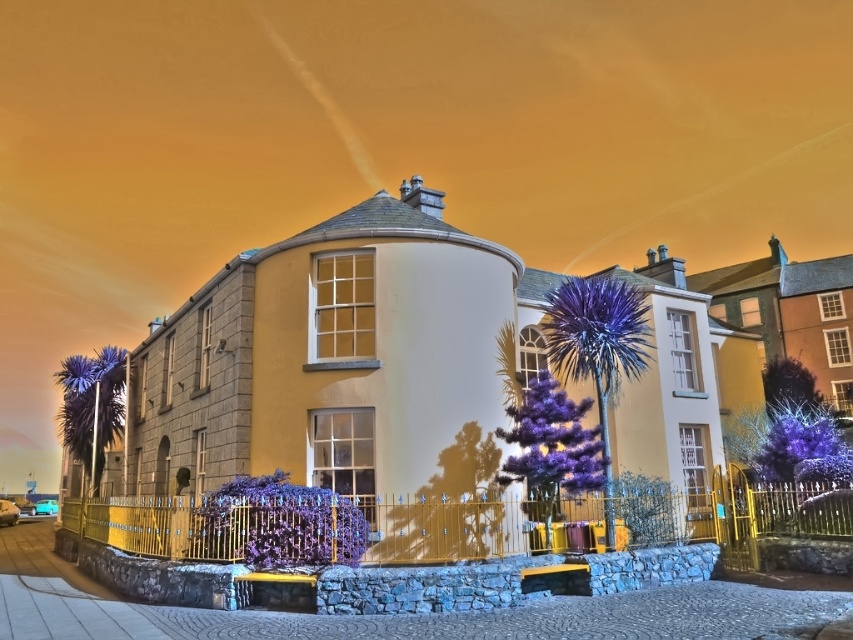
You are standing at the entrance of the building and want to place a new bench exactly at the center of the cobblestone street. The purple metallic palm tree at center is located at coordinate point 0.545, 0.702. Can you determine if the bench will be placed closer to the building or the fence?

The purple metallic palm tree at center is located at coordinate point (598, 348). Since the palm tree is at the center, the bench placed at the center of the cobblestone street would align with it, meaning it would be equidistant from both the building and the fence.

You are standing on the cobblestone street in front of the two story building. You see a purple metallic palm tree at center and a purple spiky palm at left. Which one is taller?

The purple metallic palm tree at center is taller than the purple spiky palm at left.

You are standing on the cobblestone street in front of the two story building. You see a purple metallic palm tree at center and a purple spiky palm at left. Which one has a larger width?

The purple metallic palm tree at center might be wider than purple spiky palm at left.